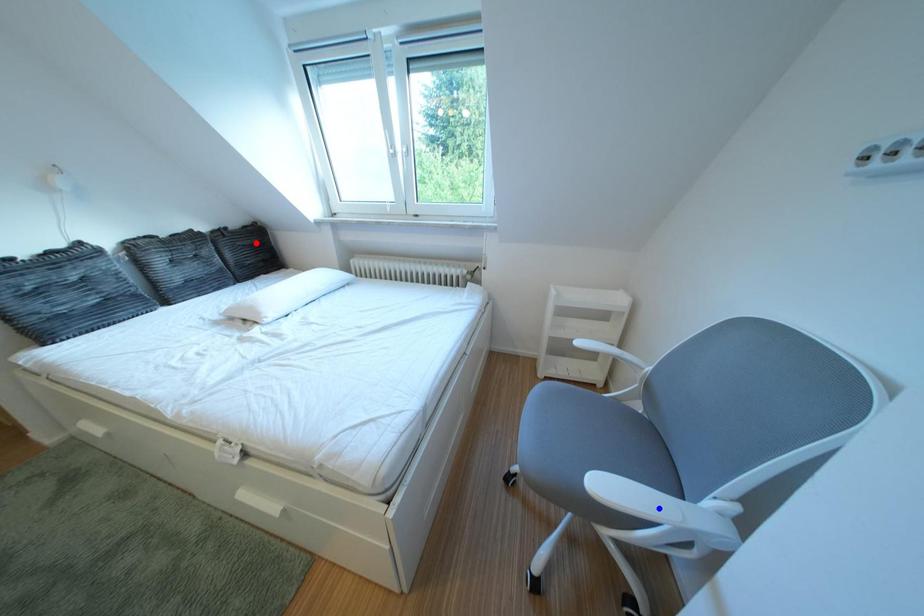
Question: Two points are marked on the image. Which point is closer to the camera?

Choices:
 (A) Blue point is closer.
 (B) Red point is closer.

Answer: (A)